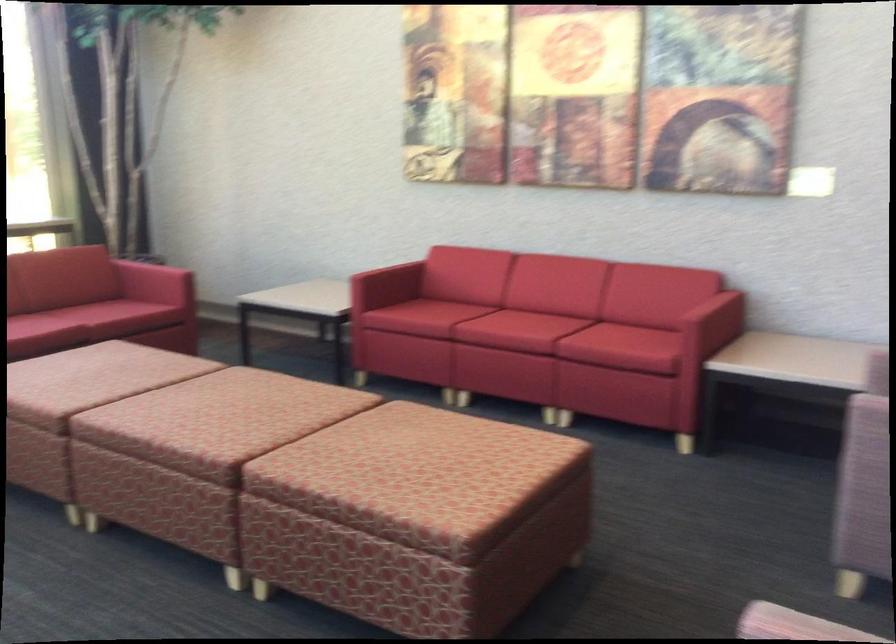
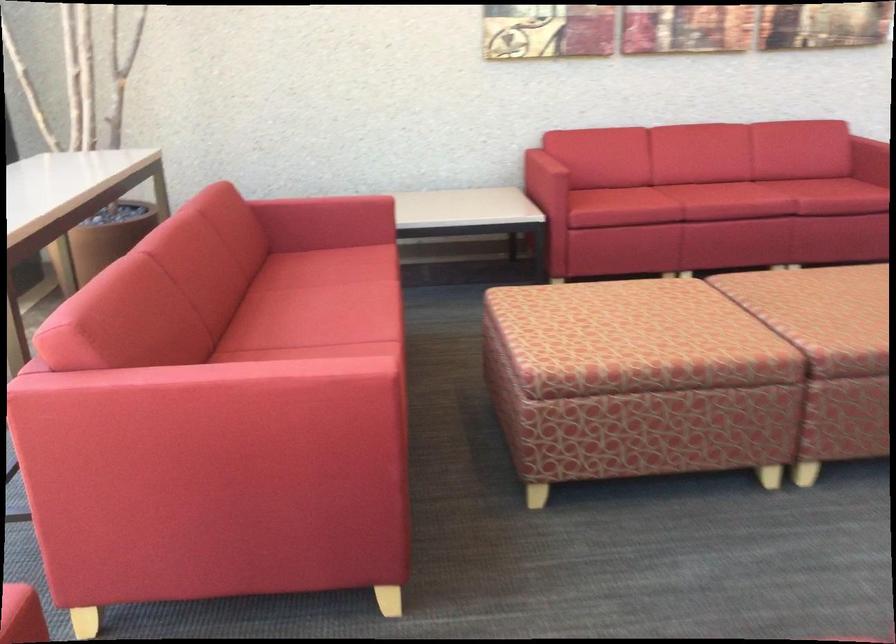
In the second image, find the point that corresponds to point 174,404 in the first image.

(834, 317)